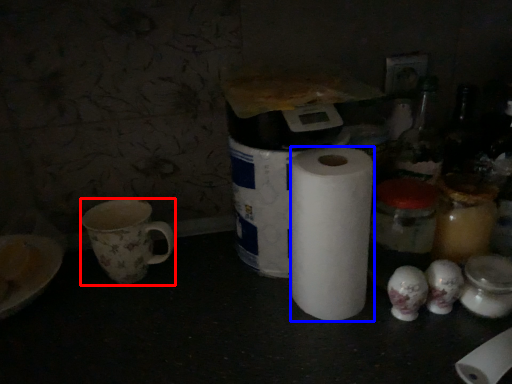
Question: Which point is further to the camera, coffee cup (highlighted by a red box) or paper towel (highlighted by a blue box)?

Choices:
 (A) coffee cup
 (B) paper towel

Answer: (A)